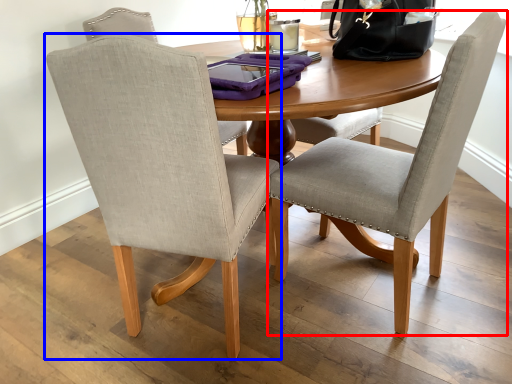
Question: Which object is further to the camera taking this photo, chair (highlighted by a red box) or chair (highlighted by a blue box)?

Choices:
 (A) chair
 (B) chair

Answer: (A)